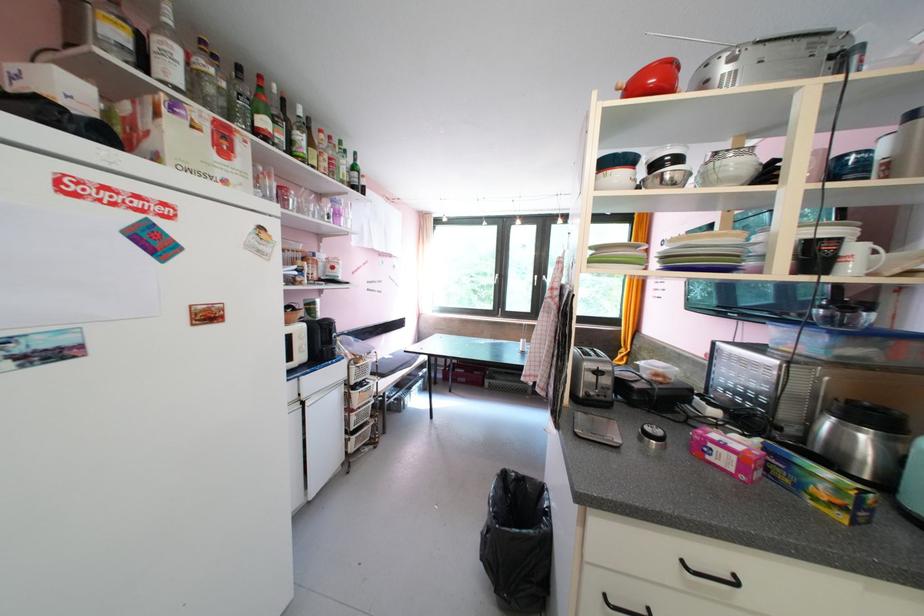
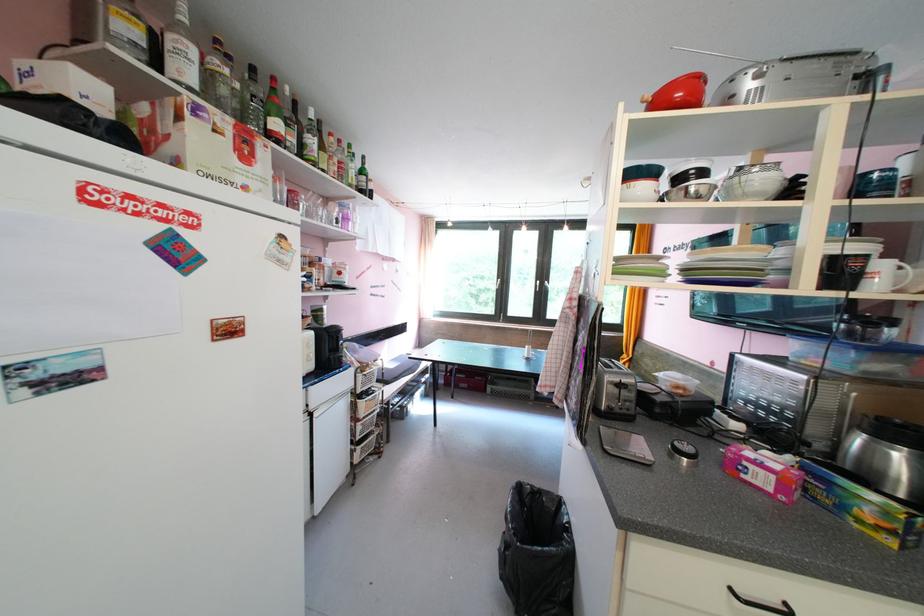
Question: Which direction would the cameraman need to move to produce the second image? Reply with the corresponding letter.

Choices:
 (A) Left
 (B) Right
 (C) Forward
 (D) Backward

Answer: (A)